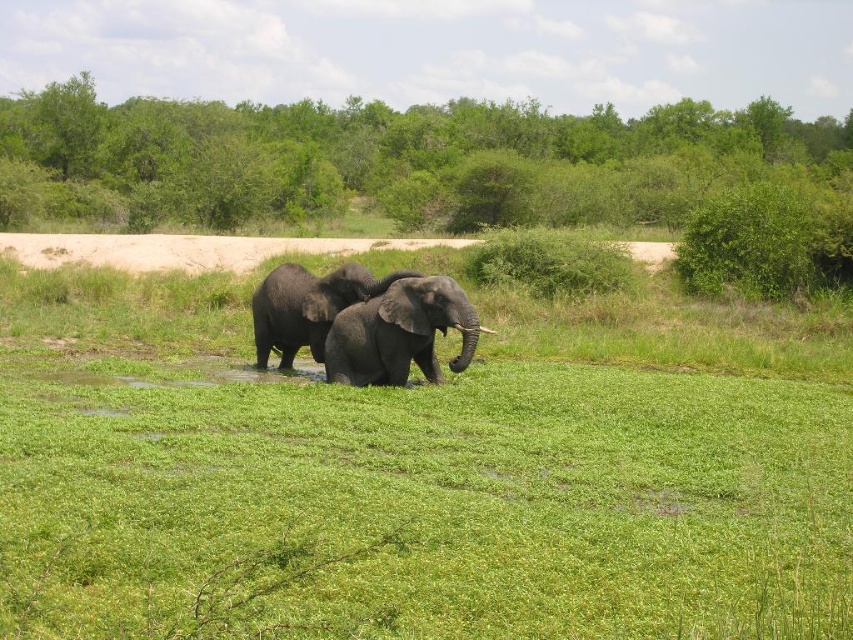
Question: From the image, what is the correct spatial relationship of green grassy at center in relation to shiny gray elephant at center?

Choices:
 (A) left
 (B) right

Answer: (B)

Question: Estimate the real-world distances between objects in this image. Which object is farther from the green grassy at center?

Choices:
 (A) shiny gray elephant at center
 (B) shiny black elephant at center

Answer: (A)

Question: Considering the relative positions of green grassy at center and shiny black elephant at center in the image provided, where is green grassy at center located with respect to shiny black elephant at center?

Choices:
 (A) above
 (B) below

Answer: (B)

Question: Which is farther from the shiny black elephant at center?

Choices:
 (A) shiny gray elephant at center
 (B) green grassy at center

Answer: (B)

Question: Observing the image, what is the correct spatial positioning of green grassy at center in reference to shiny gray elephant at center?

Choices:
 (A) right
 (B) left

Answer: (A)

Question: Which point is farther to the camera?

Choices:
 (A) green grassy at center
 (B) shiny black elephant at center

Answer: (B)